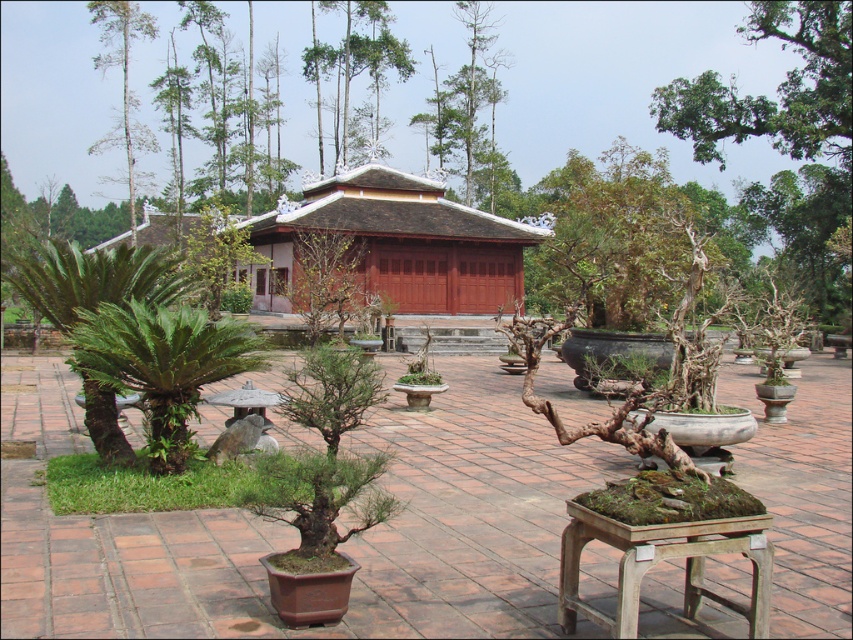
You are standing at the entrance of the courtyard and want to locate the matte wood hut at center. According to the coordinates provided, where would you find it?

The matte wood hut at center is located at coordinates point (399,243).

You are standing in a courtyard and want to take a closer look at the matte wood hut at center. If you walk straight ahead, will you get closer to it?

Yes, because the matte wood hut at center is 26.39 meters away from the camera, so walking straight ahead will reduce the distance between you and the matte wood hut at center.

You are standing at the entrance of the red wooden pavilion and want to place a new potted plant at the point marked by coordinates [296,532]. Is there already a potted plant at that location?

Yes, there is already a potted plant at the coordinates [296,532] as the brown clay pot at center is represented by that point.